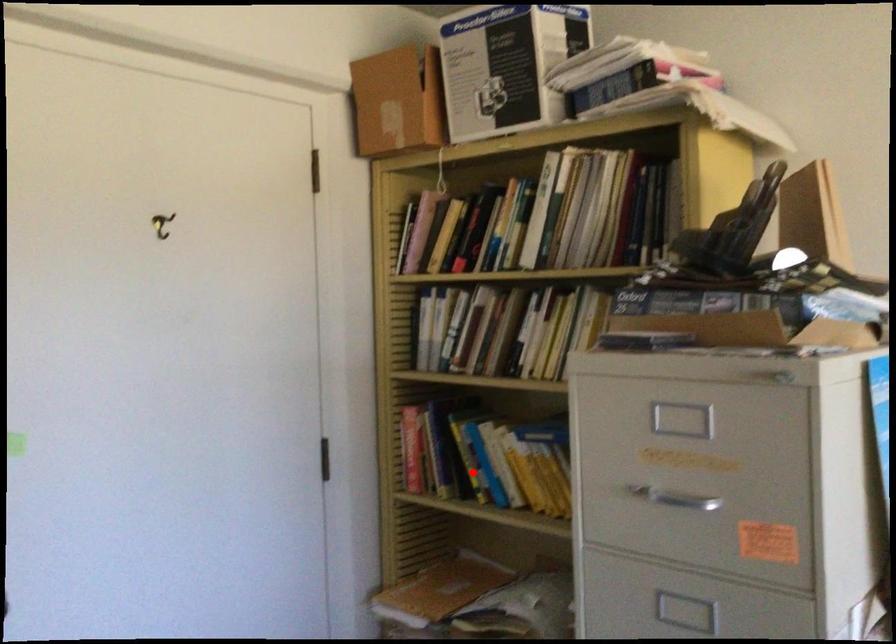
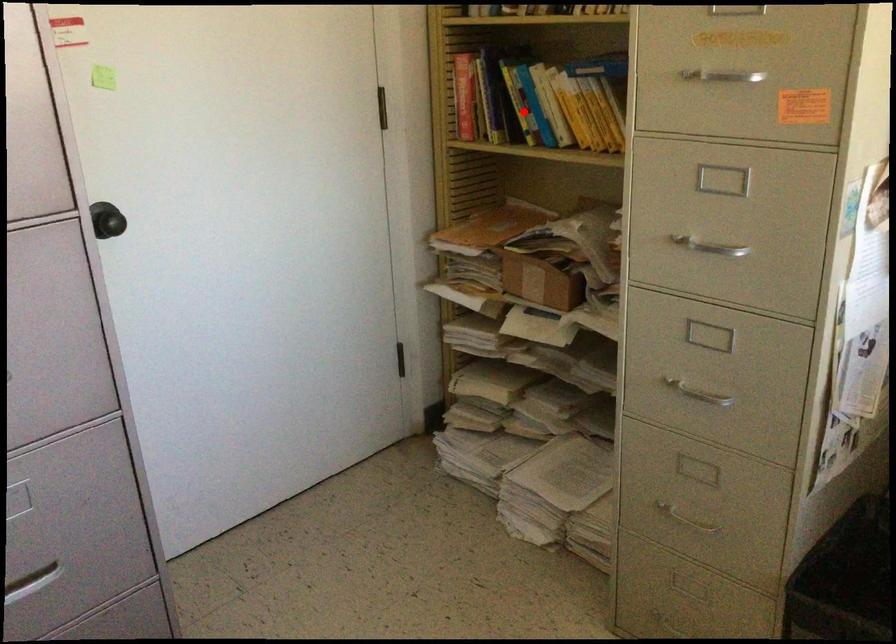
I am providing you with two images of the same scene from different viewpoints. A red point is marked on the first image and another point is marked on the second image. Does the point marked in image1 correspond to the same location as the one in image2?

Yes